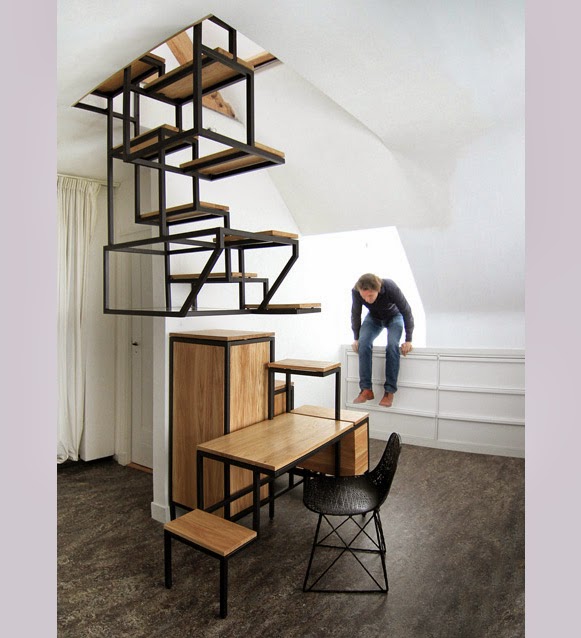
At what (x,y) coordinates should I click in order to perform the action: click on second lowest table surface. Please return your answer as a coordinate pair (x, y). Looking at the image, I should click on (289, 439).